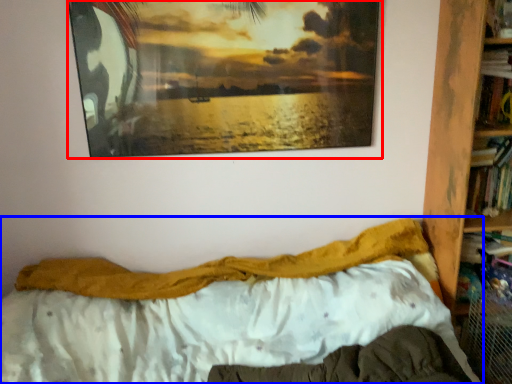
Question: Which object is closer to the camera taking this photo, picture frame (highlighted by a red box) or bed (highlighted by a blue box)?

Choices:
 (A) picture frame
 (B) bed

Answer: (B)